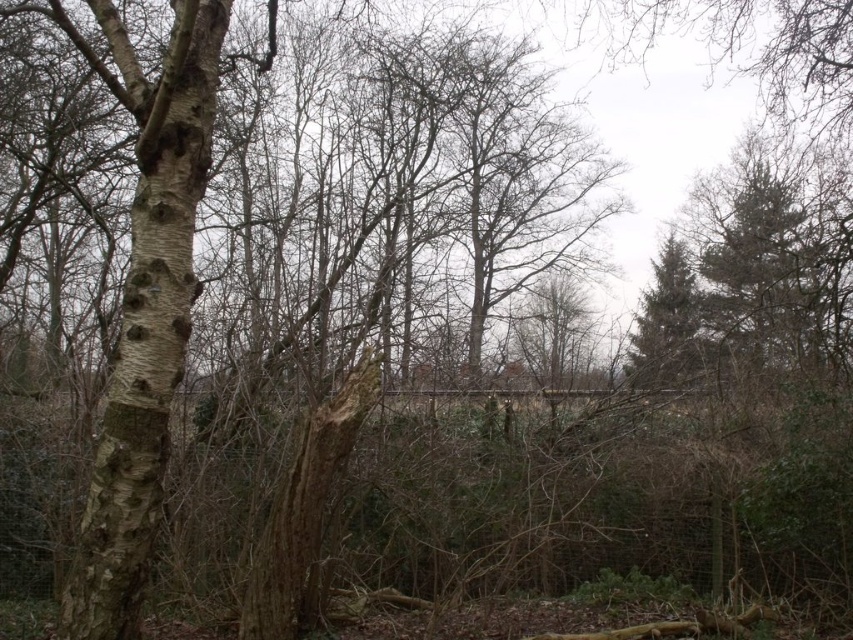
You are an animal looking to climb a tree. You see the barky white birch tree at left and the green textured pine tree at right. Which tree is positioned higher in the scene?

The barky white birch tree at left is located above the green textured pine tree at right, so it is positioned higher in the scene.

You are a hiker who wants to take a photo of both the barky white birch tree at left and the green textured pine tree at right. Since you have a camera with a fixed focal length, you need to stand at a position where both trees are fully visible in the frame. Given their sizes, which tree should you position closer to the camera to ensure both are in the shot?

The barky white birch tree at left is larger in size compared to the green textured pine tree at right. To ensure both are fully visible in the camera frame, you should position the larger barky white birch tree at left closer to the camera. This way, the smaller green textured pine tree at right can be accommodated within the same shot without either being cut off.